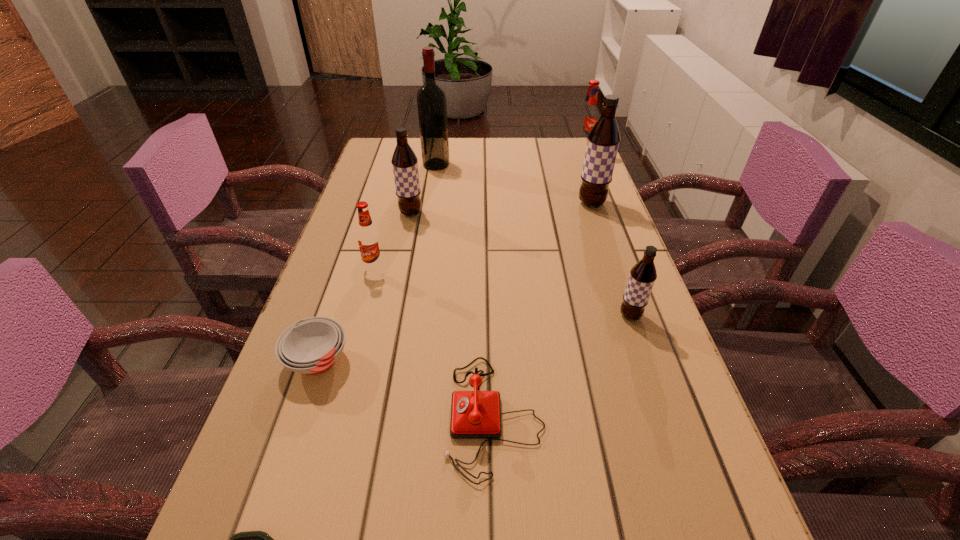
The image size is (960, 540). I want to click on vacant space at the far left corner, so coord(374,152).

Find the location of `free space at the far right corner of the desktop`. free space at the far right corner of the desktop is located at coordinates (557, 159).

Identify the location of vacant area that lies between the white soup bowl and the leftmost brown root beer. The height and width of the screenshot is (540, 960). click(364, 287).

Identify the location of empty space that is in between the nearer red root beer and the sixth farthest object. The height and width of the screenshot is (540, 960). (502, 292).

The image size is (960, 540). Identify the location of free space that is in between the nearest root beer and the biggest brown root beer. (611, 260).

Find the location of a particular element. Image resolution: width=960 pixels, height=540 pixels. vacant area that lies between the nearest brown root beer and the nearer red root beer is located at coordinates (502, 292).

Locate an element on the screen. This screenshot has height=540, width=960. free spot between the biggest brown root beer and the telephone is located at coordinates (543, 310).

Locate an element on the screen. Image resolution: width=960 pixels, height=540 pixels. unoccupied area between the left red root beer and the second smallest brown root beer is located at coordinates (393, 241).

Identify the location of the fifth closest object to the shortest object. The width and height of the screenshot is (960, 540). (404, 161).

This screenshot has height=540, width=960. I want to click on the closest object to the alcohol, so click(404, 161).